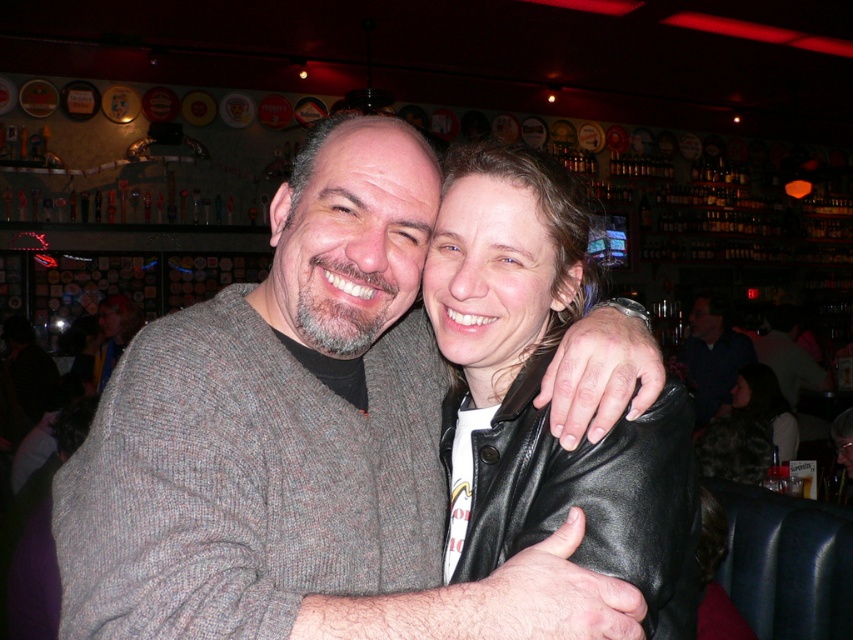
You are standing at the point marked as point (740, 404) in the bar scene. You want to take a photo of the couple using a camera that has a maximum focus range of 15 feet. Will the camera be able to focus on the couple?

The distance between point (740, 404) and the camera is 14.71 feet, which is within the camera maximum focus range of 15 feet. Therefore, the camera can focus on the couple.

You are standing in front of the bar scene. The black leather jacket at lower right is located at coordinates point 0.673, 0.879. If you want to place a small flower vase exactly 0.1 units to the right of the jacket, what would be the new coordinates?

The new coordinates would be calculated by adding 0.1 to the x value of the black leather jacket at lower right. The original x coordinate is 0.673, so adding 0.1 gives 0.773. The y coordinate remains 0.879. Therefore, the new coordinates are (749, 493).

You are a photographer setting up for a group photo. You have two items in the scene, the black leather jacket at lower right and the dark blue shirt at center. Which item is narrower in width?

The black leather jacket at lower right has a lesser width compared to the dark blue shirt at center, so the black leather jacket at lower right is narrower in width.